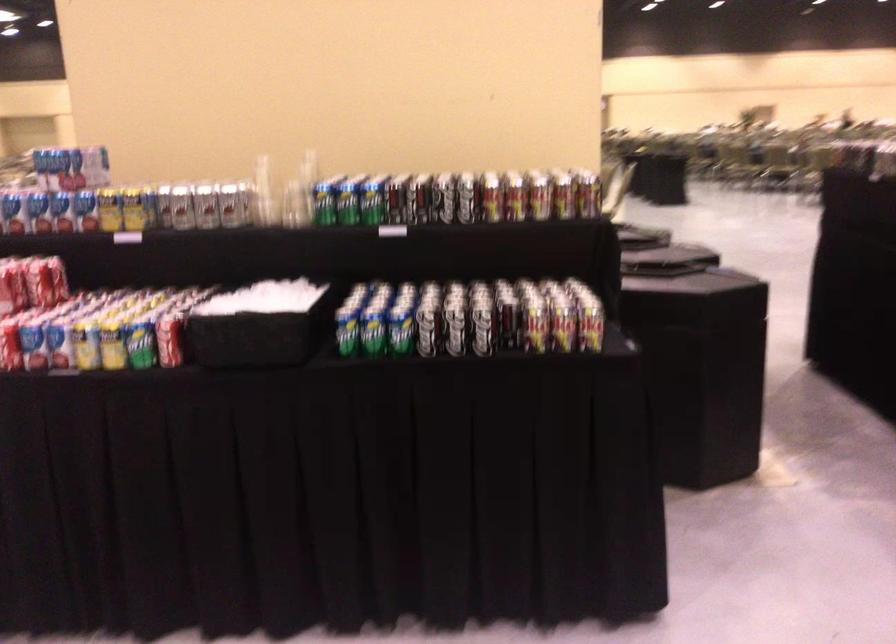
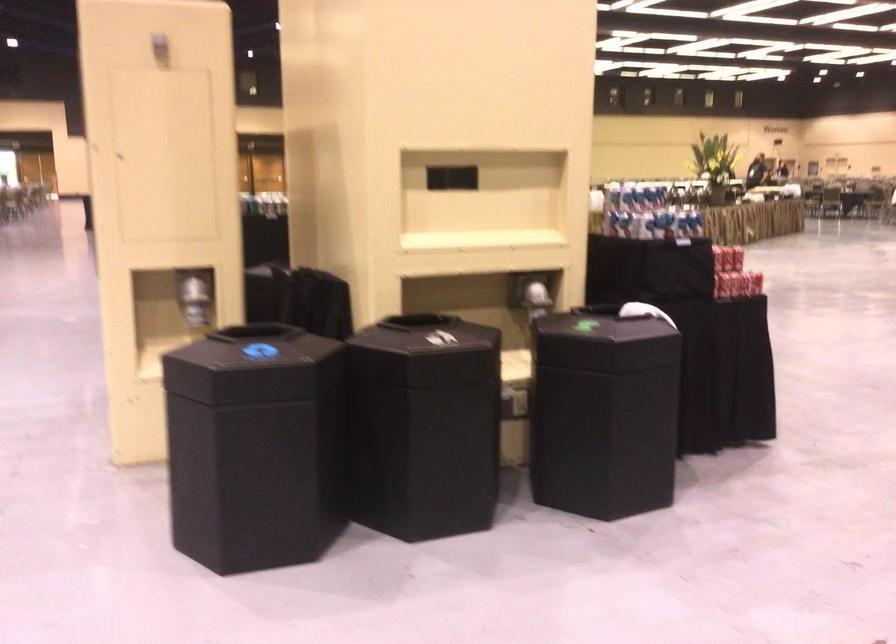
Question: I am providing you with two images of the same scene from different viewpoints. After the viewpoint changes to image2, which objects are now occluded?

Choices:
 (A) black bin lid
 (B) white shower door handle
 (C) shiny dispenser lever
 (D) silver soda can

Answer: (D)